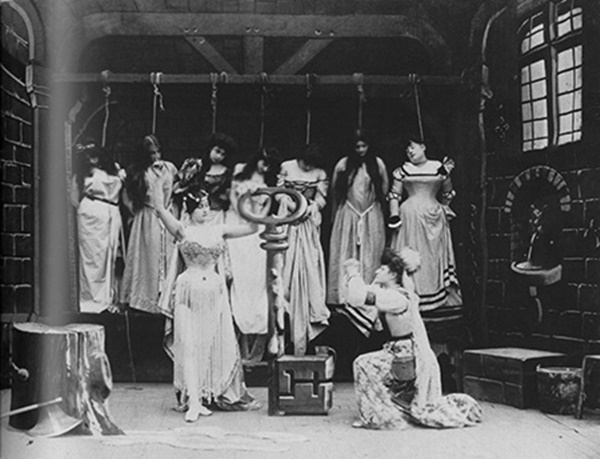
Can you see any white floor? wood? in the image? Point to them. Your answer should be formatted as a list of tuples, i.e. [(x1, y1), (x2, y2), ...], where each tuple contains the x and y coordinates of a point satisfying the conditions above.

[(355, 442)]